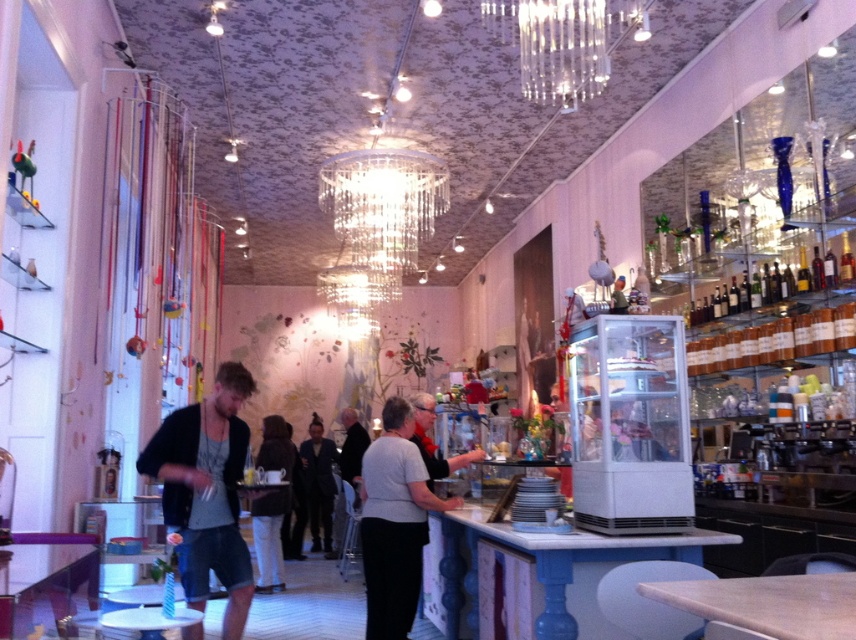
Question: Which point appears closest to the camera in this image?

Choices:
 (A) coord(272,529)
 (B) coord(438,454)

Answer: (B)

Question: Is denim shorts at center bigger than dark brown leather jacket at center?

Choices:
 (A) yes
 (B) no

Answer: (B)

Question: Is denim shorts at center thinner than matte black shirt at center?

Choices:
 (A) yes
 (B) no

Answer: (B)

Question: Which point is closer to the camera taking this photo?

Choices:
 (A) coord(444,467)
 (B) coord(355,502)
 (C) coord(270,566)
 (D) coord(238,369)

Answer: (D)

Question: Which object appears closest to the camera in this image?

Choices:
 (A) dark gray sweater at center
 (B) gray matte shirt at center
 (C) black fabric jacket at center

Answer: (B)

Question: Is gray matte shirt at center positioned behind clear crystal chandelier at upper center?

Choices:
 (A) no
 (B) yes

Answer: (A)